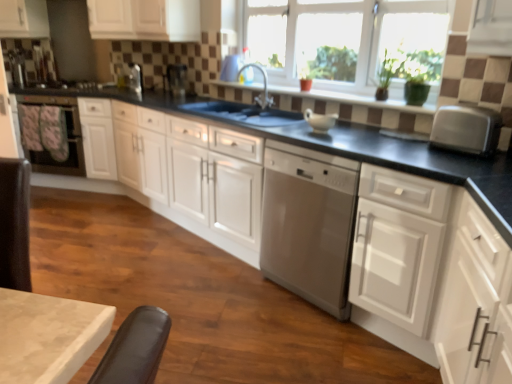
The image size is (512, 384). Identify the location of free location above satin silver dishwasher at center, the second home appliance positioned from the left (from a real-world perspective). (346, 136).